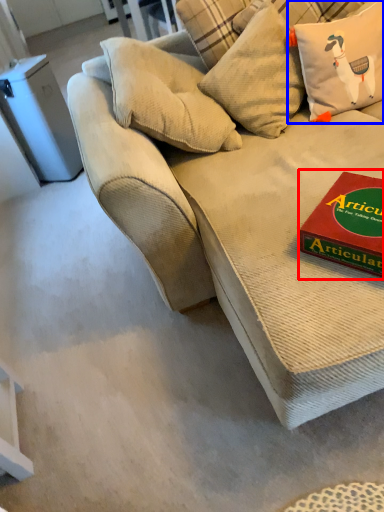
Question: Which object is closer to the camera taking this photo, paperback book (highlighted by a red box) or pillow (highlighted by a blue box)?

Choices:
 (A) paperback book
 (B) pillow

Answer: (A)